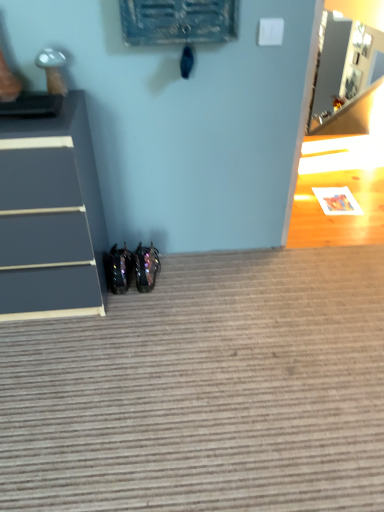
At what (x,y) coordinates should I click in order to perform the action: click on free point to the right of matte gray chest of drawers at left. Please return your answer as a coordinate pair (x, y). This screenshot has height=512, width=384. Looking at the image, I should click on (156, 307).